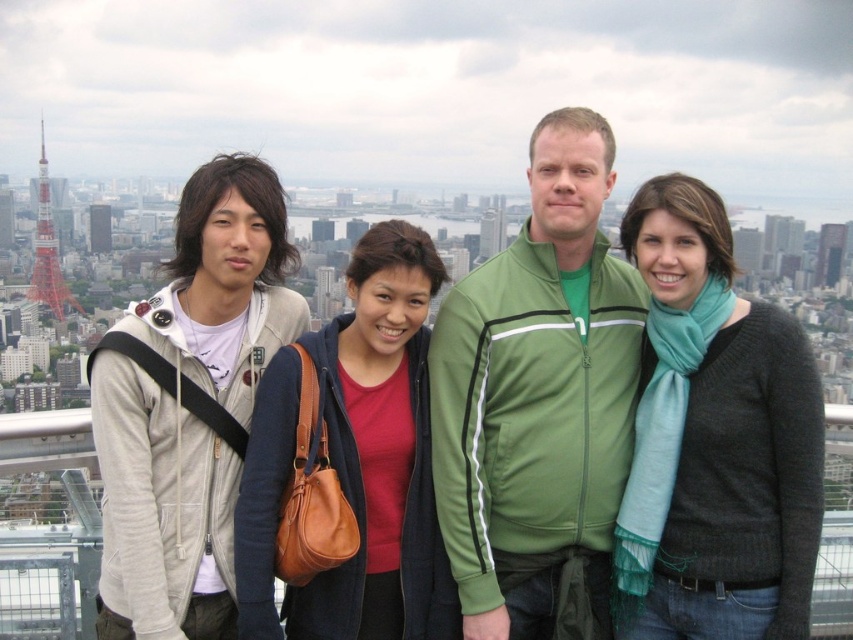
Question: Is matte gray hoodie at left below red painted metal tower at upper left?

Choices:
 (A) yes
 (B) no

Answer: (A)

Question: Does matte gray hoodie at left have a lesser width compared to red painted metal tower at upper left?

Choices:
 (A) yes
 (B) no

Answer: (B)

Question: Which of the following is the farthest from the observer?

Choices:
 (A) (45, 243)
 (B) (479, 288)

Answer: (A)

Question: Which point is farther to the camera?

Choices:
 (A) matte gray hoodie at left
 (B) red painted metal tower at upper left

Answer: (B)

Question: Observing the image, what is the correct spatial positioning of matte gray hoodie at left in reference to red painted metal tower at upper left?

Choices:
 (A) below
 (B) above

Answer: (A)